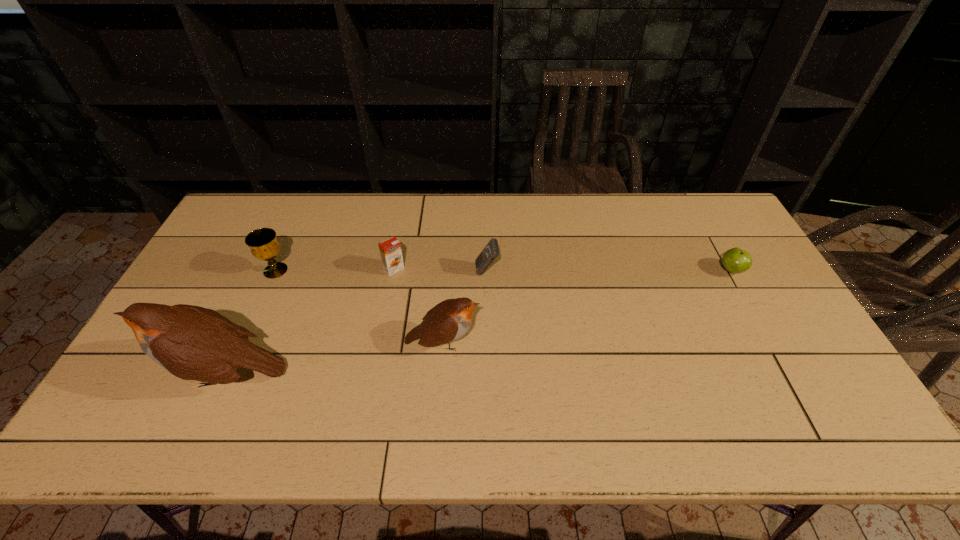
Find the location of a particular element. the taller bird is located at coordinates 193,343.

Image resolution: width=960 pixels, height=540 pixels. I want to click on the tallest object, so click(x=193, y=343).

Locate an element on the screen. The image size is (960, 540). the fifth shortest object is located at coordinates (449, 320).

This screenshot has height=540, width=960. Find the location of `the shorter bird`. the shorter bird is located at coordinates (449, 320).

The image size is (960, 540). Find the location of `chalice`. chalice is located at coordinates (262, 242).

Identify the location of the third object from left to right. This screenshot has height=540, width=960. (390, 249).

Identify the location of apple. The width and height of the screenshot is (960, 540). (735, 260).

Find the location of a particular element. Image resolution: width=960 pixels, height=540 pixels. the shortest object is located at coordinates (735, 260).

Identify the location of calculator. Image resolution: width=960 pixels, height=540 pixels. (491, 251).

Identify the location of vacant point located at the face of the tallest object. The height and width of the screenshot is (540, 960). (132, 374).